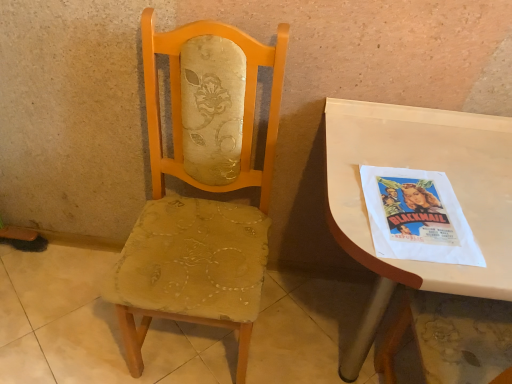
Find the location of a particular element. Image resolution: width=512 pixels, height=384 pixels. free region on the left part of white paper poster at right is located at coordinates (349, 205).